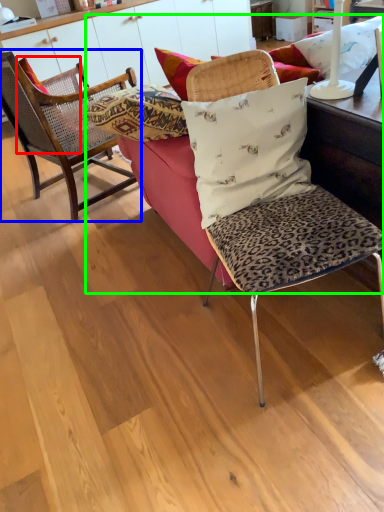
Question: Which is nearer to the pillow (highlighted by a red box)? chair (highlighted by a blue box) or studio couch (highlighted by a green box).

Choices:
 (A) chair
 (B) studio couch

Answer: (A)